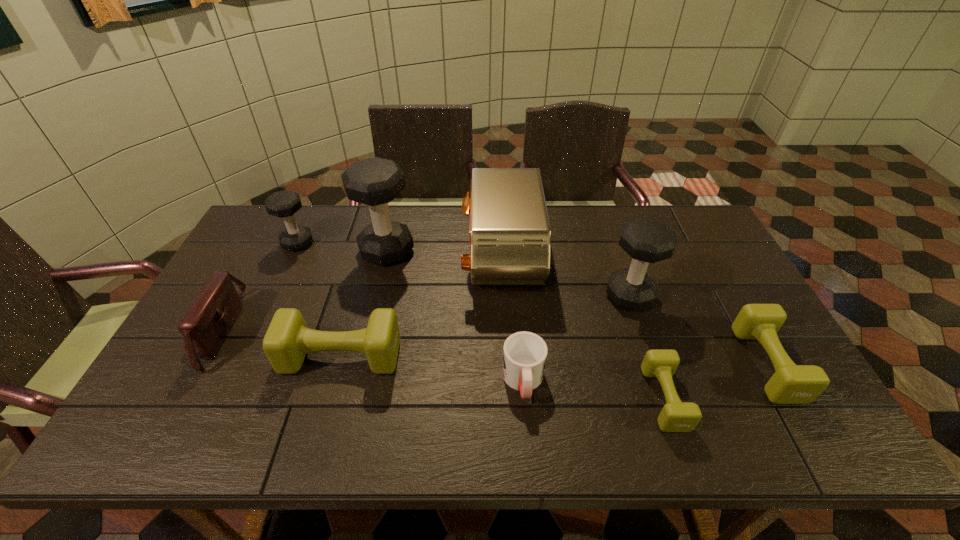
Locate an element on the screen. object present at the right edge is located at coordinates (790, 384).

At what (x,y) coordinates should I click in order to perform the action: click on object located in the far left corner section of the desktop. Please return your answer as a coordinate pair (x, y). The image size is (960, 540). Looking at the image, I should click on (283, 204).

This screenshot has height=540, width=960. I want to click on vacant area at the far edge of the desktop, so click(366, 215).

In the image, there is a desktop. Identify the location of free space at the near edge. (691, 437).

Locate an element on the screen. free spot at the left edge of the desktop is located at coordinates (251, 277).

In the image, there is a desktop. Identify the location of vacant space at the right edge. The image size is (960, 540). (704, 306).

Image resolution: width=960 pixels, height=540 pixels. Find the location of `blank space at the far right corner`. blank space at the far right corner is located at coordinates (693, 217).

Where is `free space between the shoulder bag and the second biggest olive dumbbell`? free space between the shoulder bag and the second biggest olive dumbbell is located at coordinates (492, 347).

What are the coordinates of `vacant region between the smallest olive dumbbell and the smallest gray dumbbell` in the screenshot? It's located at (481, 321).

Identify the location of empty space between the biggest gray dumbbell and the shortest object. (526, 325).